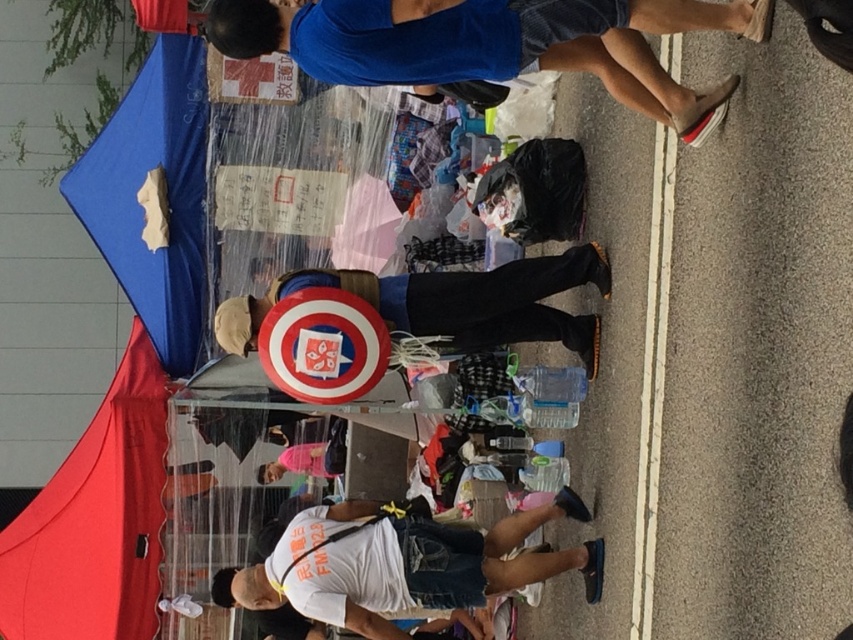
This screenshot has height=640, width=853. Find the location of `blue cotton shirt at upper center`. blue cotton shirt at upper center is located at coordinates (492, 44).

Which is more to the right, blue cotton shirt at upper center or red fabric canopy at lower left?

From the viewer's perspective, blue cotton shirt at upper center appears more on the right side.

Which is in front, point (268, 8) or point (68, 525)?

Positioned in front is point (268, 8).

You are a GUI agent. You are given a task and a screenshot of the screen. Output one action in this format:
    pyautogui.click(x=<x>, y=<y>)
    Task: Click on the blue cotton shirt at upper center
    The height and width of the screenshot is (640, 853).
    Given the screenshot: What is the action you would take?
    pyautogui.click(x=492, y=44)

Consider the image. Can you confirm if red fabric canopy at lower left is positioned to the left of white cotton t-shirt at lower center?

Correct, you'll find red fabric canopy at lower left to the left of white cotton t-shirt at lower center.

Is point (77, 509) positioned in front of point (314, 548)?

That is False.

Image resolution: width=853 pixels, height=640 pixels. I want to click on red fabric canopy at lower left, so click(96, 520).

Describe the element at coordinates (492, 44) in the screenshot. I see `blue cotton shirt at upper center` at that location.

Between blue cotton shirt at upper center and white cotton t-shirt at lower center, which one appears on the left side from the viewer's perspective?

white cotton t-shirt at lower center

In order to click on blue cotton shirt at upper center in this screenshot , I will do `click(492, 44)`.

The image size is (853, 640). I want to click on blue cotton shirt at upper center, so click(x=492, y=44).